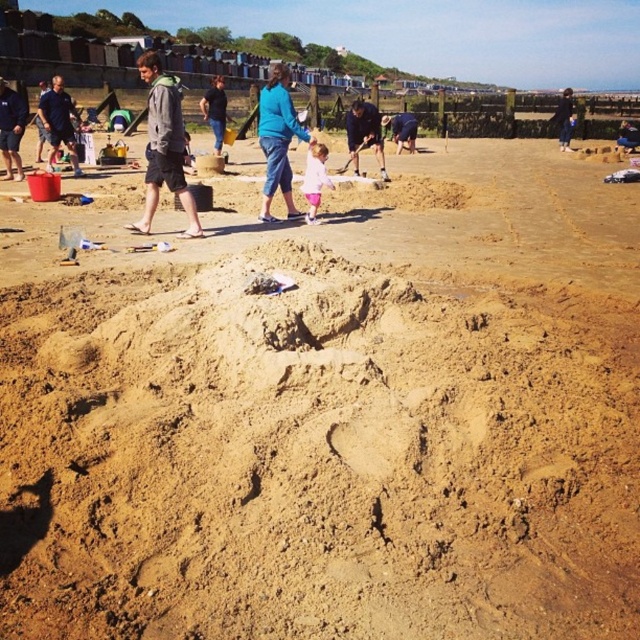
Is blue fabric pants at center taller than smooth sandcastle at center?

Indeed, blue fabric pants at center has a greater height compared to smooth sandcastle at center.

Who is higher up, blue fabric pants at center or smooth sandcastle at center?

blue fabric pants at center is above.

Is point (280, 186) positioned before point (625, 148)?

Yes, it is in front of point (625, 148).

Locate an element on the screen. This screenshot has width=640, height=640. blue fabric pants at center is located at coordinates pos(276,140).

Who is more distant from viewer, (60,134) or (209,96)?

Positioned behind is point (209,96).

Between dark blue shirt at left and blue denim jeans at center, which one has more height?

blue denim jeans at center

Who is more distant from viewer, [51,108] or [212,109]?

The point [212,109] is more distant.

The height and width of the screenshot is (640, 640). What are the coordinates of `dark blue shirt at left` in the screenshot? It's located at (58, 122).

Between pink fabric pants at center and blue denim jeans at center, which one appears on the right side from the viewer's perspective?

From the viewer's perspective, pink fabric pants at center appears more on the right side.

Can you confirm if pink fabric pants at center is positioned above blue denim jeans at center?

No.

Who is more distant from viewer, (x=314, y=186) or (x=218, y=140)?

The point (x=218, y=140) is more distant.

Locate an element on the screen. The image size is (640, 640). pink fabric pants at center is located at coordinates (314, 179).